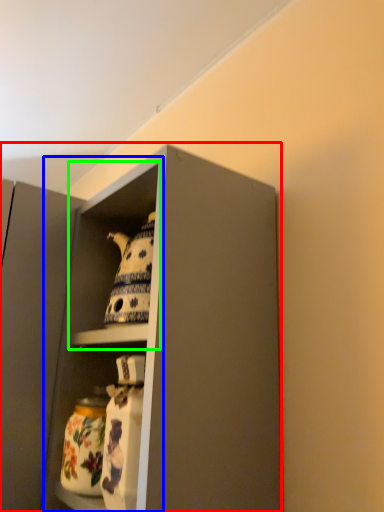
Question: Which is farther away from cabinetry (highlighted by a red box)? cabinet (highlighted by a blue box) or cabinet (highlighted by a green box)?

Choices:
 (A) cabinet
 (B) cabinet

Answer: (A)